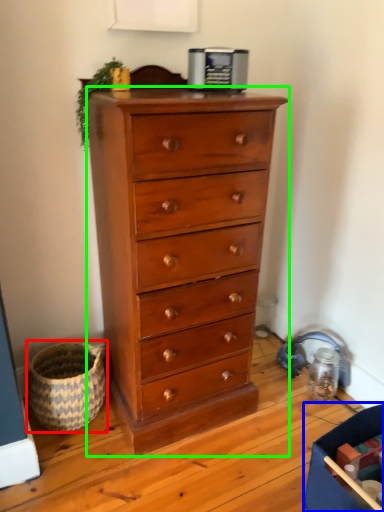
Question: Based on their relative distances, which object is farther from basket (highlighted by a red box)? Choose from storage box (highlighted by a blue box) and chest of drawers (highlighted by a green box).

Choices:
 (A) storage box
 (B) chest of drawers

Answer: (A)